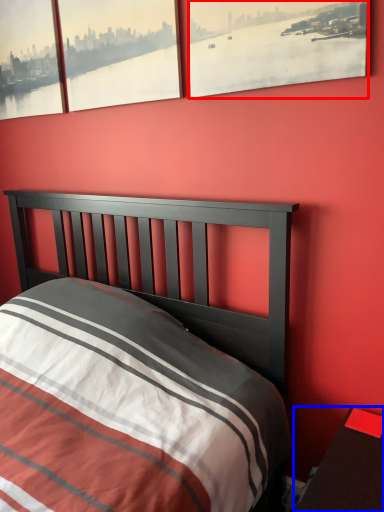
Question: Which object is closer to the camera taking this photo, window (highlighted by a red box) or nightstand (highlighted by a blue box)?

Choices:
 (A) window
 (B) nightstand

Answer: (B)